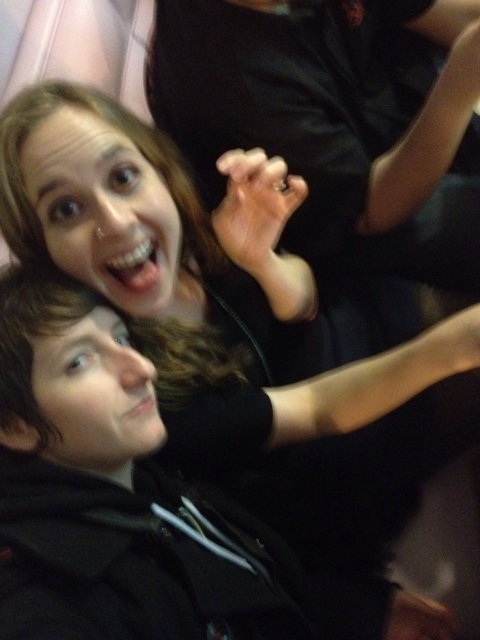
You are trying to take a photo of the black hoodie at lower left but the matte black hand at center is blocking your view. Can you move the hand to the side to get a clear shot?

The black hoodie at lower left is behind the matte black hand at center, so moving the matte black hand at center would allow you to see the black hoodie at lower left.

You are standing in the room and want to touch the matte black hand at center without moving it. To do this, should you reach up or down from the black hoodie at lower left?

The matte black hand at center is located above the black hoodie at lower left, so you should reach up from the black hoodie at lower left to touch it without moving the hand.

In the scene, there are a matte black hand at center and a black hoodie at lower left. From the perspective of someone looking at the image, which object is positioned to the right side?

The matte black hand at center is positioned to the right of the black hoodie at lower left.